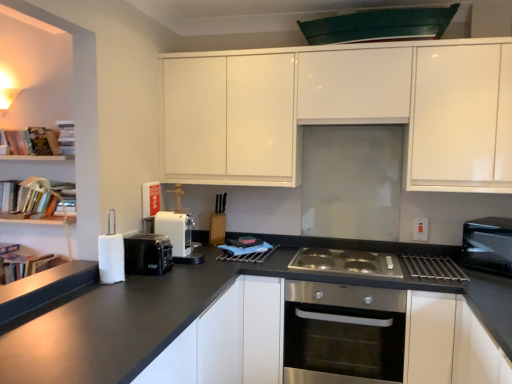
Question: Does white plastic coffee machine at center, positioned as the 1th appliance in back-to-front order, have a greater height compared to white plastic electric outlet at right?

Choices:
 (A) yes
 (B) no

Answer: (A)

Question: Is white plastic coffee machine at center, marked as the second appliance in a front-to-back arrangement, thinner than white plastic electric outlet at right?

Choices:
 (A) yes
 (B) no

Answer: (B)

Question: Could you tell me if white plastic coffee machine at center, marked as the second appliance in a front-to-back arrangement, is turned towards white plastic electric outlet at right?

Choices:
 (A) yes
 (B) no

Answer: (B)

Question: Does white plastic coffee machine at center, positioned as the 1th appliance in back-to-front order, appear on the left side of white plastic electric outlet at right?

Choices:
 (A) yes
 (B) no

Answer: (A)

Question: From the image's perspective, is white plastic coffee machine at center, positioned as the 1th appliance in back-to-front order, beneath white plastic electric outlet at right?

Choices:
 (A) no
 (B) yes

Answer: (B)

Question: Considering the relative positions of silver metallic gas stove at center and stainless steel oven at center in the image provided, is silver metallic gas stove at center to the left or to the right of stainless steel oven at center?

Choices:
 (A) right
 (B) left

Answer: (A)

Question: In terms of height, does silver metallic gas stove at center look taller or shorter compared to stainless steel oven at center?

Choices:
 (A) short
 (B) tall

Answer: (A)

Question: Looking at the image, does silver metallic gas stove at center seem bigger or smaller compared to stainless steel oven at center?

Choices:
 (A) big
 (B) small

Answer: (B)

Question: Which is correct: silver metallic gas stove at center is inside stainless steel oven at center, or outside of it?

Choices:
 (A) inside
 (B) outside

Answer: (A)

Question: Is silver metallic gas stove at center wider or thinner than white matte cabinet at center, the second cabinetry when ordered from top to bottom?

Choices:
 (A) wide
 (B) thin

Answer: (B)

Question: Considering the positions of silver metallic gas stove at center and white matte cabinet at center, marked as the first cabinetry in a bottom-to-top arrangement, in the image, is silver metallic gas stove at center bigger or smaller than white matte cabinet at center, marked as the first cabinetry in a bottom-to-top arrangement,?

Choices:
 (A) big
 (B) small

Answer: (B)

Question: Considering the positions of point (350, 271) and point (282, 349), is point (350, 271) closer or farther from the camera than point (282, 349)?

Choices:
 (A) closer
 (B) farther

Answer: (A)

Question: Is silver metallic gas stove at center inside the boundaries of white matte cabinet at center, marked as the first cabinetry in a bottom-to-top arrangement, or outside?

Choices:
 (A) outside
 (B) inside

Answer: (A)

Question: Is silver metallic gas stove at center wider or thinner than hardcover books at upper left, the 4th book from the left?

Choices:
 (A) wide
 (B) thin

Answer: (A)

Question: Is silver metallic gas stove at center inside or outside of hardcover books at upper left, which ranks as the 1th book in right-to-left order?

Choices:
 (A) outside
 (B) inside

Answer: (A)